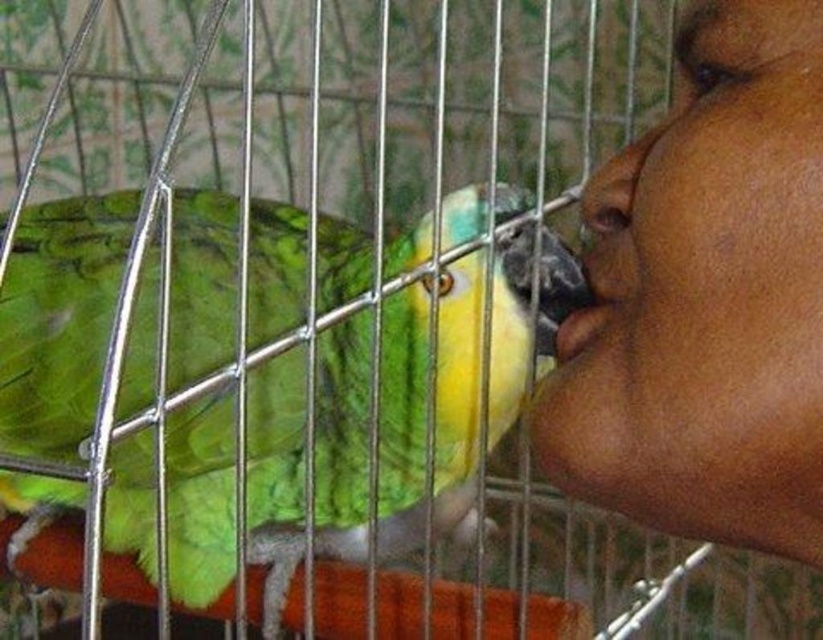
Measure the distance between green feathered parrot at left and smooth skin face at upper right.

The distance of green feathered parrot at left from smooth skin face at upper right is 13.78 inches.

The image size is (823, 640). Find the location of `green feathered parrot at left`. green feathered parrot at left is located at coordinates (59, 321).

Is green feathered parrot at left to the right of matte skin nose at right from the viewer's perspective?

No, green feathered parrot at left is not to the right of matte skin nose at right.

Find the location of a particular element. green feathered parrot at left is located at coordinates (59, 321).

Who is more forward, (257, 508) or (607, 198)?

Point (607, 198) is more forward.

Locate an element on the screen. green feathered parrot at left is located at coordinates (59, 321).

Does smooth skin face at upper right appear on the left side of smooth skin at mouth right?

In fact, smooth skin face at upper right is to the right of smooth skin at mouth right.

Image resolution: width=823 pixels, height=640 pixels. Describe the element at coordinates (709, 298) in the screenshot. I see `smooth skin face at upper right` at that location.

Where is `smooth skin face at upper right`? Image resolution: width=823 pixels, height=640 pixels. smooth skin face at upper right is located at coordinates (709, 298).